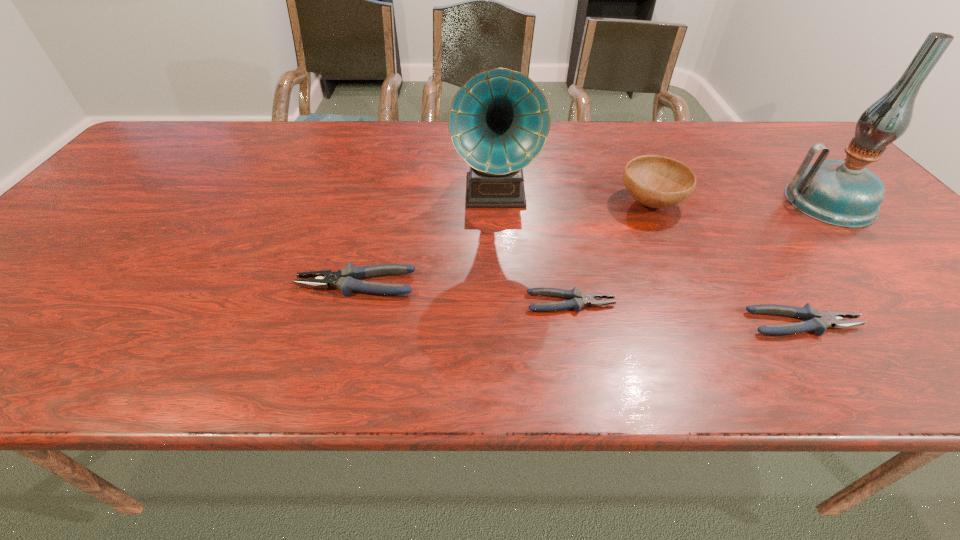
The image size is (960, 540). I want to click on free region at the left edge of the desktop, so click(x=154, y=183).

You are a GUI agent. You are given a task and a screenshot of the screen. Output one action in this format:
    pyautogui.click(x=<x>, y=<y>)
    Task: Click on the free region at the right edge
    This screenshot has width=960, height=540.
    Given the screenshot: What is the action you would take?
    pyautogui.click(x=905, y=244)

In the image, there is a desktop. Identify the location of vacant space at the far left corner. (197, 126).

You are a GUI agent. You are given a task and a screenshot of the screen. Output one action in this format:
    pyautogui.click(x=<x>, y=<y>)
    Task: Click on the vacant point located between the leftmost pliers and the bowl
    This screenshot has height=540, width=960.
    Given the screenshot: What is the action you would take?
    pyautogui.click(x=503, y=244)

The width and height of the screenshot is (960, 540). I want to click on free area in between the bowl and the rightmost object, so click(x=738, y=202).

The image size is (960, 540). Identify the location of vacant area that lies between the phonograph_record and the shortest object. (533, 248).

The image size is (960, 540). Identify the location of unoccupied area between the rightmost object and the leftmost pliers. (591, 242).

I want to click on free spot between the second tallest object and the leftmost object, so click(x=426, y=239).

Where is `vacant space that is in between the rightmost object and the shortest object`? The width and height of the screenshot is (960, 540). vacant space that is in between the rightmost object and the shortest object is located at coordinates (699, 252).

Where is `empty space that is in between the oil lamp and the shortest pliers`? The width and height of the screenshot is (960, 540). empty space that is in between the oil lamp and the shortest pliers is located at coordinates (699, 252).